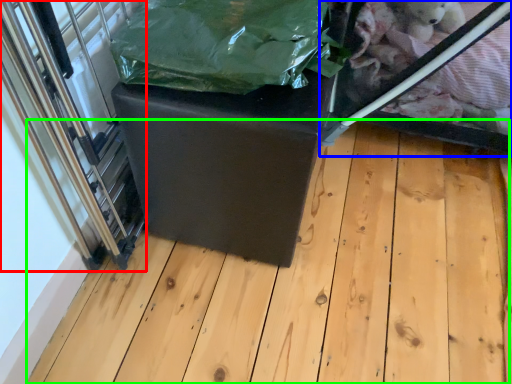
Question: Which object is positioned closest to glass door (highlighted by a red box)? Select from glass box (highlighted by a blue box) and wood (highlighted by a green box).

Choices:
 (A) glass box
 (B) wood

Answer: (B)